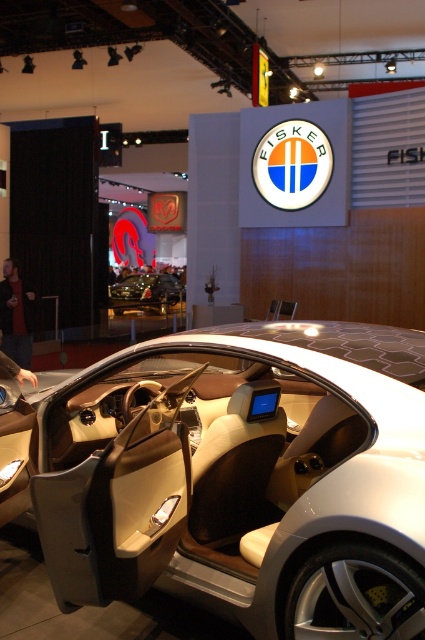
Does shiny black car at center appear under dark gray jacket at lower left?

No, shiny black car at center is not below dark gray jacket at lower left.

This screenshot has width=425, height=640. Identify the location of shiny black car at center. (146, 292).

At what (x,y) coordinates should I click in order to perform the action: click on shiny black car at center. Please return your answer as a coordinate pair (x, y). This screenshot has width=425, height=640. Looking at the image, I should click on pos(146,292).

Does matte beige interior at center have a lesser height compared to dark gray jacket at lower left?

In fact, matte beige interior at center may be taller than dark gray jacket at lower left.

Between matte beige interior at center and dark gray jacket at lower left, which one has less height?

Standing shorter between the two is dark gray jacket at lower left.

Who is more forward, (410,582) or (11,362)?

Result: Positioned in front is point (410,582).

The image size is (425, 640). Find the location of `matte beige interior at center`. matte beige interior at center is located at coordinates (240, 476).

Who is more distant from viewer, (11, 321) or (19, 378)?

The point (11, 321) is behind.

Between black leather jacket at lower left and dark gray jacket at lower left, which one appears on the left side from the viewer's perspective?

black leather jacket at lower left is more to the left.

The image size is (425, 640). I want to click on black leather jacket at lower left, so click(x=14, y=316).

At what (x,y) coordinates should I click in order to perform the action: click on black leather jacket at lower left. Please return your answer as a coordinate pair (x, y). Looking at the image, I should click on (14, 316).